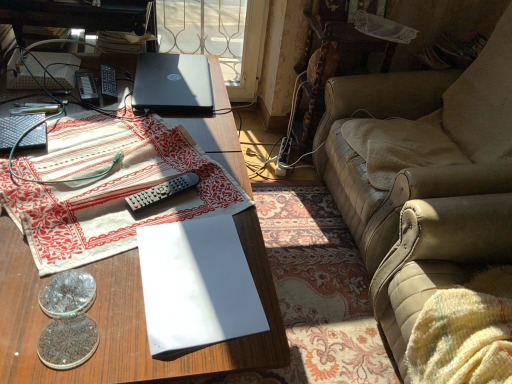
Locate an element on the screen. Image resolution: width=512 pixels, height=384 pixels. free point above wooden desk at center (from a real-world perspective) is located at coordinates (120, 166).